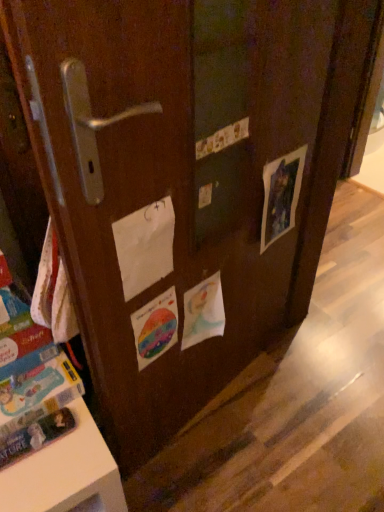
Question: Is blue cardboard book at lower left shorter than matte paper picture at right, the 3th flyer when ordered from left to right?

Choices:
 (A) yes
 (B) no

Answer: (A)

Question: From a real-world perspective, is blue cardboard book at lower left on matte paper picture at right, the 3th flyer when ordered from left to right?

Choices:
 (A) no
 (B) yes

Answer: (A)

Question: Is blue cardboard book at lower left to the right of matte paper picture at right, the 3th flyer when ordered from left to right, from the viewer's perspective?

Choices:
 (A) no
 (B) yes

Answer: (A)

Question: Is matte paper picture at right, the 3th flyer when ordered from left to right, inside blue cardboard book at lower left?

Choices:
 (A) yes
 (B) no

Answer: (B)

Question: Is blue cardboard book at lower left far away from matte paper picture at right, positioned as the first flyer in right-to-left order?

Choices:
 (A) yes
 (B) no

Answer: (B)

Question: Is point (6, 456) positioned closer to the camera than point (289, 225)?

Choices:
 (A) closer
 (B) farther

Answer: (A)

Question: Is blue cardboard book at lower left wider or thinner than matte paper picture at right, positioned as the first flyer in right-to-left order?

Choices:
 (A) wide
 (B) thin

Answer: (A)

Question: Considering the positions of blue cardboard book at lower left and matte paper picture at right, positioned as the first flyer in right-to-left order, in the image, is blue cardboard book at lower left bigger or smaller than matte paper picture at right, positioned as the first flyer in right-to-left order,?

Choices:
 (A) small
 (B) big

Answer: (B)

Question: Is blue cardboard book at lower left in front of or behind matte paper picture at right, the 3th flyer when ordered from left to right, in the image?

Choices:
 (A) front
 (B) behind

Answer: (A)

Question: Looking at their shapes, would you say rainbow paper flyer at center, which is counted as the 1th flyer, starting from the left, is wider or thinner than watercolor paper flyer at center, acting as the second flyer starting from the right?

Choices:
 (A) wide
 (B) thin

Answer: (B)

Question: Based on their positions, is rainbow paper flyer at center, which is counted as the 1th flyer, starting from the left, located to the left or right of watercolor paper flyer at center, acting as the second flyer starting from the right?

Choices:
 (A) left
 (B) right

Answer: (A)

Question: Considering their positions, is rainbow paper flyer at center, placed as the 3th flyer when sorted from right to left, located in front of or behind watercolor paper flyer at center, acting as the second flyer starting from the right?

Choices:
 (A) front
 (B) behind

Answer: (A)

Question: Is rainbow paper flyer at center, which is counted as the 1th flyer, starting from the left, inside or outside of watercolor paper flyer at center, acting as the second flyer starting from the right?

Choices:
 (A) inside
 (B) outside

Answer: (B)

Question: Does point (56, 369) appear closer or farther from the camera than point (140, 335)?

Choices:
 (A) closer
 (B) farther

Answer: (B)

Question: From the image's perspective, is blue cardboard book at lower left above or below rainbow paper flyer at center, placed as the 3th flyer when sorted from right to left?

Choices:
 (A) below
 (B) above

Answer: (A)